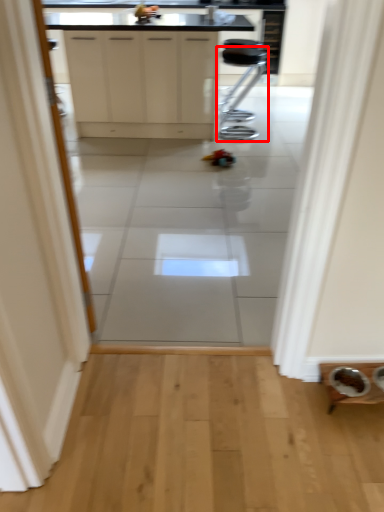
Question: From the image, what is the correct spatial relationship of furniture (annotated by the red box) in relation to cabinetry?

Choices:
 (A) right
 (B) left

Answer: (A)